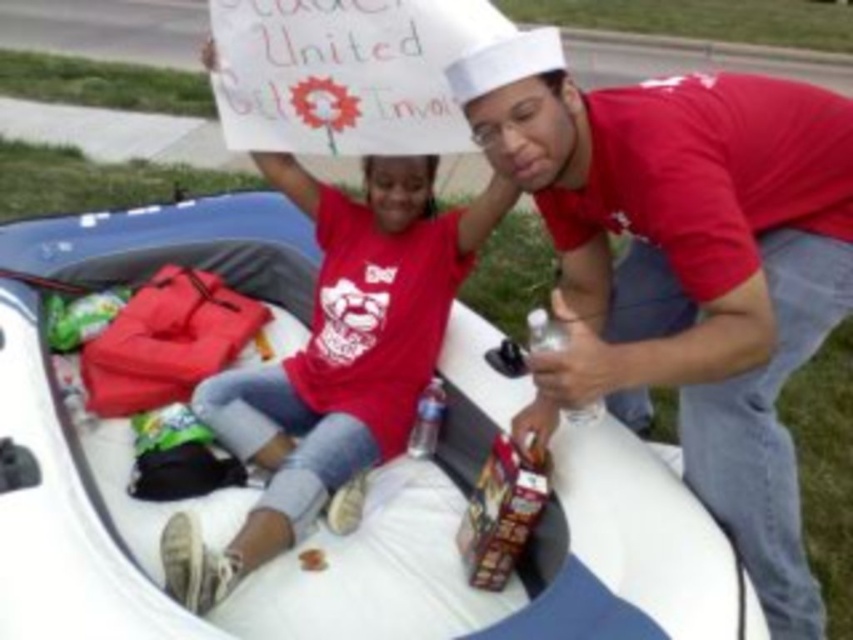
Can you confirm if white rubber boat at center is smaller than matte red t-shirt at center?

No.

From the picture: Can you confirm if white rubber boat at center is positioned to the right of matte red t-shirt at center?

Incorrect, white rubber boat at center is not on the right side of matte red t-shirt at center.

Looking at this image, who is more forward, (143, 276) or (357, 355)?

Point (357, 355) is more forward.

This screenshot has height=640, width=853. I want to click on white rubber boat at center, so click(x=97, y=516).

Does red matte t-shirt at center have a smaller size compared to clear plastic bottle at center?

Actually, red matte t-shirt at center might be larger than clear plastic bottle at center.

How distant is red matte t-shirt at center from clear plastic bottle at center?

A distance of 16.63 inches exists between red matte t-shirt at center and clear plastic bottle at center.

The height and width of the screenshot is (640, 853). Describe the element at coordinates (683, 266) in the screenshot. I see `red matte t-shirt at center` at that location.

Where is `red matte t-shirt at center`? red matte t-shirt at center is located at coordinates (683, 266).

Who is positioned more to the right, red matte t-shirt at center or matte red t-shirt at center?

Positioned to the right is red matte t-shirt at center.

Does red matte t-shirt at center have a greater height compared to matte red t-shirt at center?

Yes.

Does point (792, 182) lie behind point (479, 221)?

That is False.

Where is `red matte t-shirt at center`? red matte t-shirt at center is located at coordinates (683, 266).